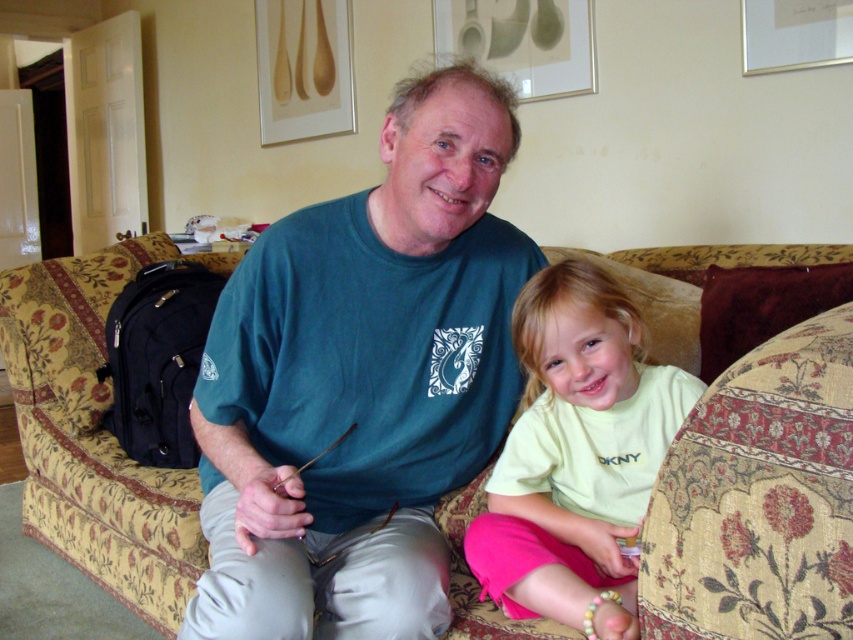
Does floral-patterned fabric couch at center have a larger size compared to white matte picture frame at upper right?

Correct, floral-patterned fabric couch at center is larger in size than white matte picture frame at upper right.

Is floral-patterned fabric couch at center thinner than white matte picture frame at upper right?

No.

Does point (753, 397) lie behind point (759, 10)?

No.

Locate an element on the screen. floral-patterned fabric couch at center is located at coordinates (759, 499).

Is the position of floral-patterned fabric couch at center less distant than that of gold-framed artwork at upper center?

Yes, floral-patterned fabric couch at center is in front of gold-framed artwork at upper center.

Who is higher up, floral-patterned fabric couch at center or gold-framed artwork at upper center?

gold-framed artwork at upper center is higher up.

Between point (160, 472) and point (544, 1), which one is positioned in front?

Point (160, 472) is in front.

Locate an element on the screen. The width and height of the screenshot is (853, 640). floral-patterned fabric couch at center is located at coordinates (759, 499).

Which of these two, light yellow cotton shirt at center or gold-framed artwork at upper center, stands shorter?

gold-framed artwork at upper center

Does light yellow cotton shirt at center have a greater width compared to gold-framed artwork at upper center?

No.

Measure the distance between light yellow cotton shirt at center and camera.

light yellow cotton shirt at center is 3.59 feet from camera.

Locate an element on the screen. This screenshot has width=853, height=640. light yellow cotton shirt at center is located at coordinates (576, 456).